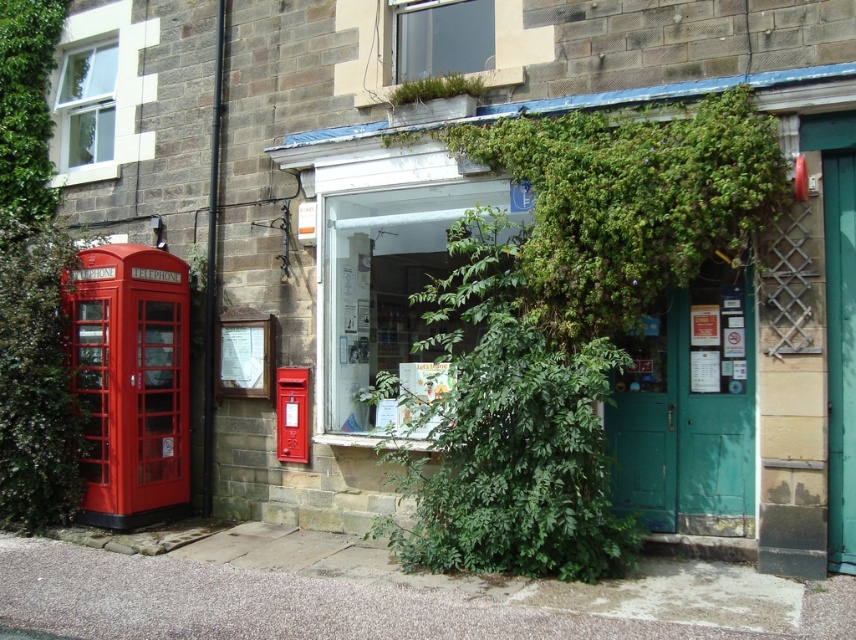
Does green leafy ivy at center come behind metallic red postbox at center?

No, it is not.

Can you confirm if green leafy ivy at center is thinner than metallic red postbox at center?

Incorrect, green leafy ivy at center's width is not less than metallic red postbox at center's.

What do you see at coordinates (504, 432) in the screenshot? Image resolution: width=856 pixels, height=640 pixels. I see `green leafy ivy at center` at bounding box center [504, 432].

Where is `green leafy ivy at center`? Image resolution: width=856 pixels, height=640 pixels. green leafy ivy at center is located at coordinates (504, 432).

Can you confirm if green wooden door at center is shorter than green leafy ivy at center?

No, green wooden door at center is not shorter than green leafy ivy at center.

Can you confirm if green wooden door at center is smaller than green leafy ivy at center?

No.

Locate an element on the screen. This screenshot has width=856, height=640. green wooden door at center is located at coordinates (583, 312).

Image resolution: width=856 pixels, height=640 pixels. What are the coordinates of `green wooden door at center` in the screenshot? It's located at (583, 312).

Is green wooden door at center further to the viewer compared to metallic red postbox at center?

No, it is in front of metallic red postbox at center.

Is green wooden door at center taller than metallic red postbox at center?

Indeed, green wooden door at center has a greater height compared to metallic red postbox at center.

Between point (610, 161) and point (299, 417), which one is positioned in front?

Point (610, 161) is in front.

Where is `green wooden door at center`? Image resolution: width=856 pixels, height=640 pixels. green wooden door at center is located at coordinates (583, 312).